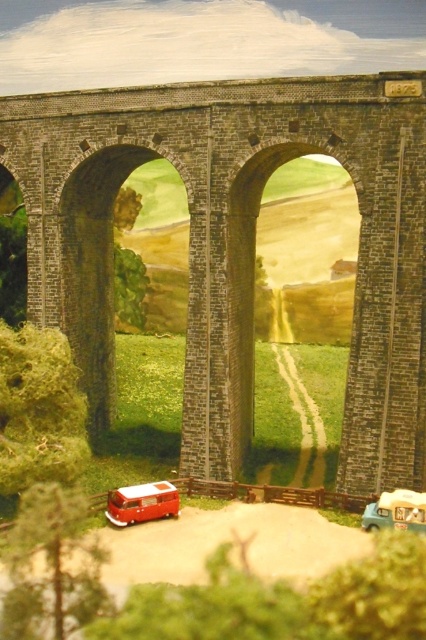
Which is below, brick stone bridge at center or shiny red van at lower left?

shiny red van at lower left

Between brick stone bridge at center and shiny red van at lower left, which one has less height?

shiny red van at lower left

What do you see at coordinates (235, 244) in the screenshot? Image resolution: width=426 pixels, height=640 pixels. I see `brick stone bridge at center` at bounding box center [235, 244].

The image size is (426, 640). Find the location of `brick stone bridge at center`. brick stone bridge at center is located at coordinates click(x=235, y=244).

In the scene shown: Can you confirm if brick stone bridge at center is wider than matte white van at lower right?

Indeed, brick stone bridge at center has a greater width compared to matte white van at lower right.

Locate an element on the screen. Image resolution: width=426 pixels, height=640 pixels. brick stone bridge at center is located at coordinates (235, 244).

This screenshot has height=640, width=426. I want to click on brick stone bridge at center, so click(x=235, y=244).

How far apart are shiny red van at lower left and matte white van at lower right?

The distance of shiny red van at lower left from matte white van at lower right is 6.88 meters.

Based on the photo, does shiny red van at lower left have a lesser width compared to matte white van at lower right?

No.

The height and width of the screenshot is (640, 426). I want to click on shiny red van at lower left, so click(141, 502).